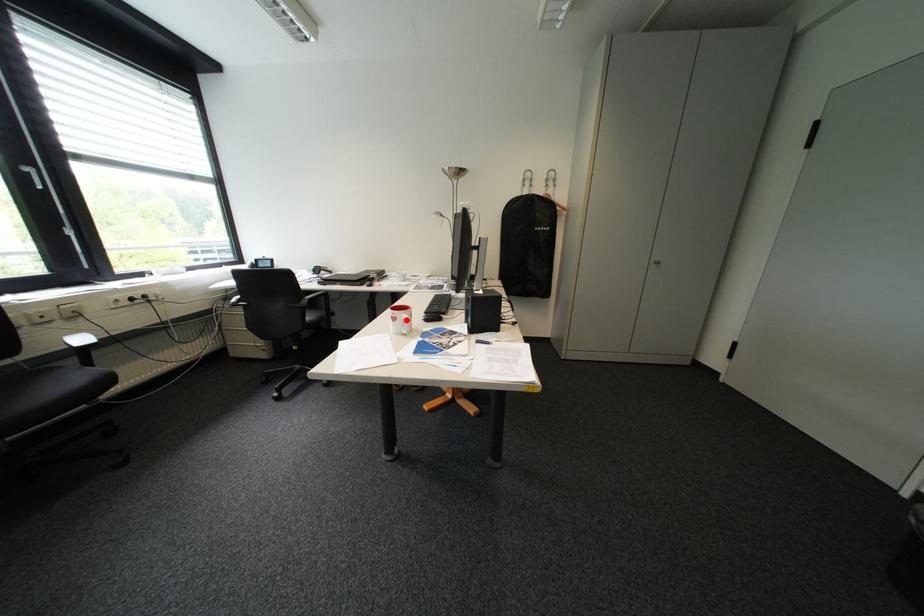
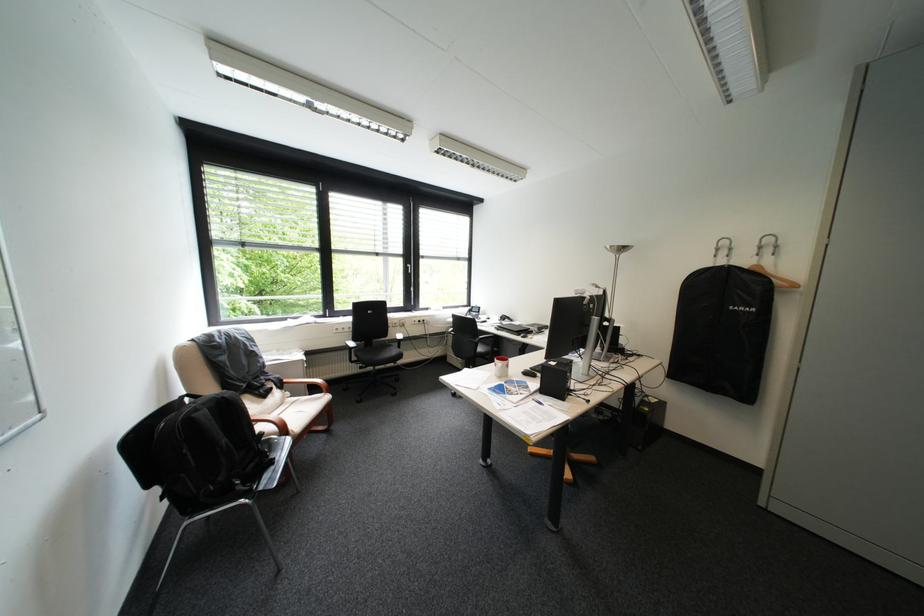
Question: A red point is marked in image1. In image2, is the corresponding 3D point closer to the camera or farther? Reply with the corresponding letter.

Choices:
 (A) The corresponding 3D point is closer.
 (B) The corresponding 3D point is farther.

Answer: (A)